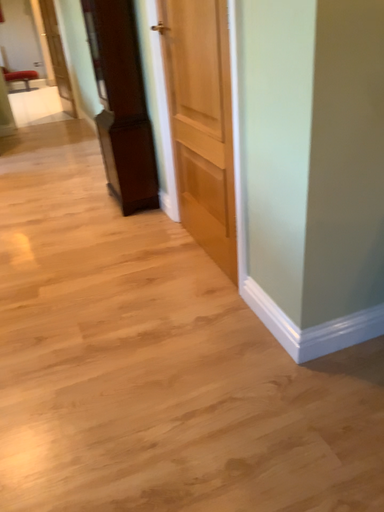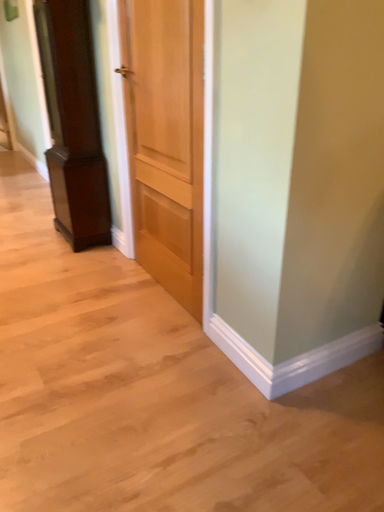
Question: How did the camera likely rotate when shooting the video?

Choices:
 (A) rotated right
 (B) rotated left

Answer: (A)